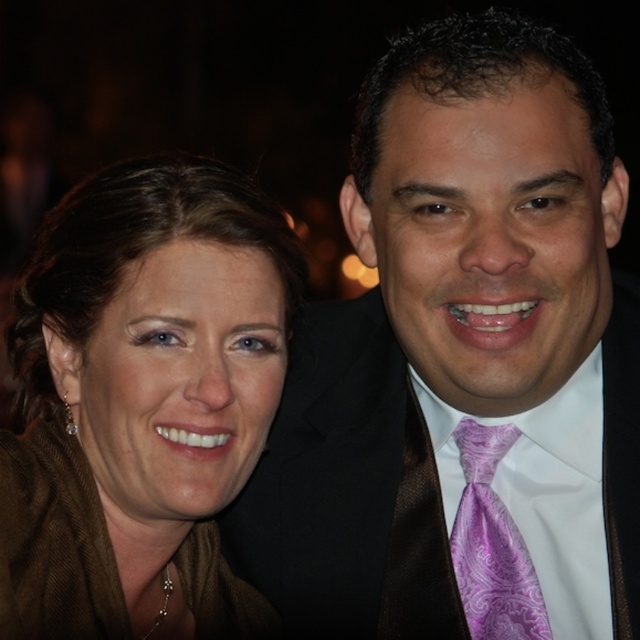
Based on the scene description, which object is taller between the purple satin tie at right and the brown fabric at left?

The purple satin tie at right is much taller than the brown fabric at left.

You are a photographer at an event and notice two details in the image. There is a purple satin tie at right and a brown fabric at left. From the photographer viewpoint, which one is positioned to the right?

The purple satin tie at right is positioned to the right of the brown fabric at left.